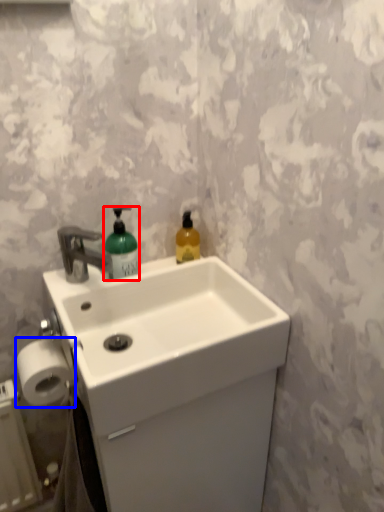
Question: Which object appears farthest to the camera in this image, bottle (highlighted by a red box) or toilet paper (highlighted by a blue box)?

Choices:
 (A) bottle
 (B) toilet paper

Answer: (A)